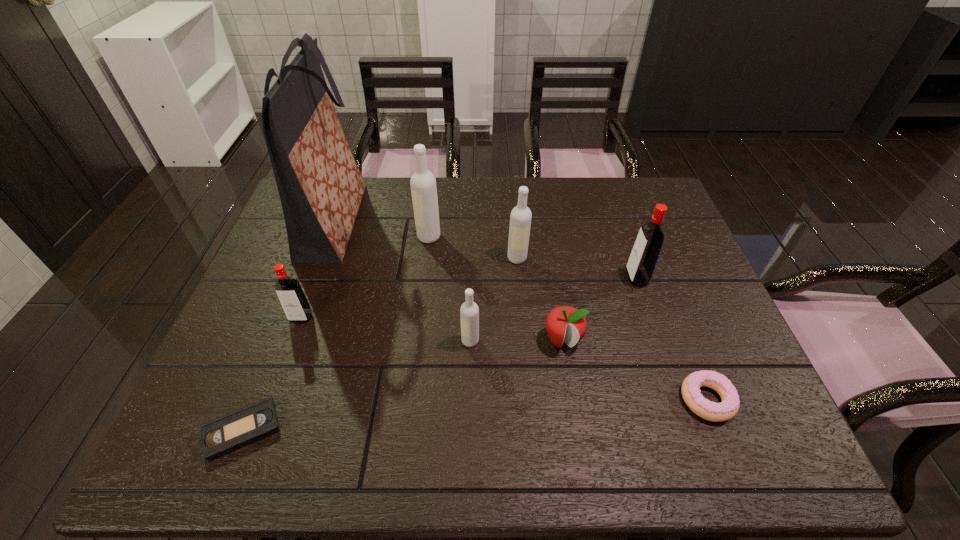
Locate an element on the screen. The width and height of the screenshot is (960, 540). the tallest object is located at coordinates (320, 186).

Where is `the biggest white vodka`? This screenshot has height=540, width=960. the biggest white vodka is located at coordinates (423, 183).

The height and width of the screenshot is (540, 960). What are the coordinates of `the farthest vodka` in the screenshot? It's located at (423, 183).

Identify the location of the second farthest white vodka. The image size is (960, 540). (520, 219).

This screenshot has width=960, height=540. In order to click on the rightmost white vodka in this screenshot , I will do `click(520, 219)`.

At what (x,y) coordinates should I click in order to perform the action: click on the right red vodka. Please return your answer as a coordinate pair (x, y). This screenshot has height=540, width=960. Looking at the image, I should click on (642, 261).

Identify the location of the farther red vodka. (642, 261).

Where is `the fifth object from right to left`? the fifth object from right to left is located at coordinates (469, 312).

The height and width of the screenshot is (540, 960). In order to click on the third vodka from right to left in this screenshot , I will do `click(469, 312)`.

Locate an element on the screen. This screenshot has width=960, height=540. the fourth farthest vodka is located at coordinates (291, 296).